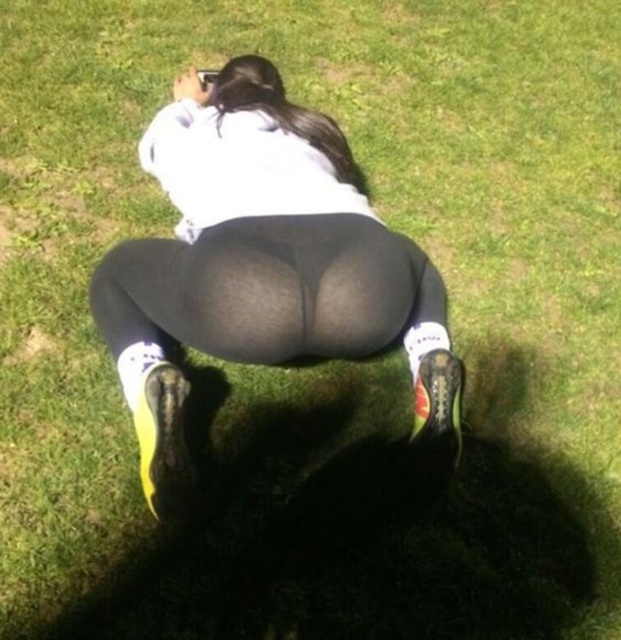
This screenshot has width=621, height=640. What do you see at coordinates (261, 264) in the screenshot?
I see `matte black leggings at center` at bounding box center [261, 264].

How distant is matte black leggings at center from black matte leggings at center?

matte black leggings at center is 10.72 centimeters away from black matte leggings at center.

Between point (268, 205) and point (160, 326), which one is positioned in front?

Point (268, 205)

This screenshot has width=621, height=640. I want to click on matte black leggings at center, so click(261, 264).